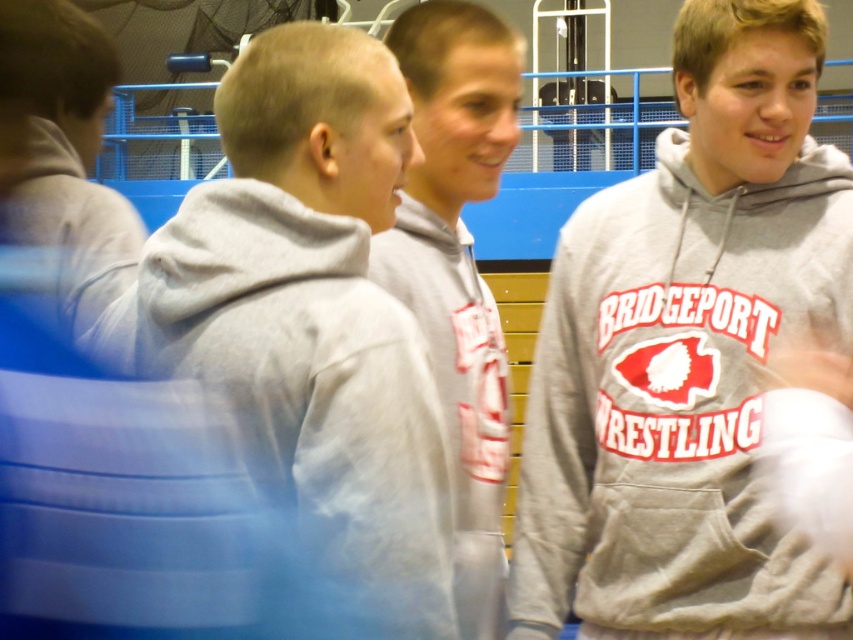
Is gray fleece sweatshirt at center positioned in front of gray matte hoodie at center?

No, it is not.

Who is more forward, (612, 525) or (399, 173)?

Point (399, 173)

Which is behind, point (515, 580) or point (271, 380)?

Point (515, 580)

Locate an element on the screen. gray fleece sweatshirt at center is located at coordinates (686, 355).

Can you confirm if gray hoodie at center is positioned to the left of gray hoodie at left?

No, gray hoodie at center is not to the left of gray hoodie at left.

Is point (433, 308) closer to camera compared to point (36, 28)?

No, it is behind (36, 28).

Identify the location of gray hoodie at center. Image resolution: width=853 pixels, height=640 pixels. (457, 262).

Is the position of gray matte hoodie at center less distant than that of gray hoodie at left?

Yes, gray matte hoodie at center is in front of gray hoodie at left.

What do you see at coordinates (308, 314) in the screenshot? I see `gray matte hoodie at center` at bounding box center [308, 314].

Identify the location of gray matte hoodie at center. The image size is (853, 640). 308,314.